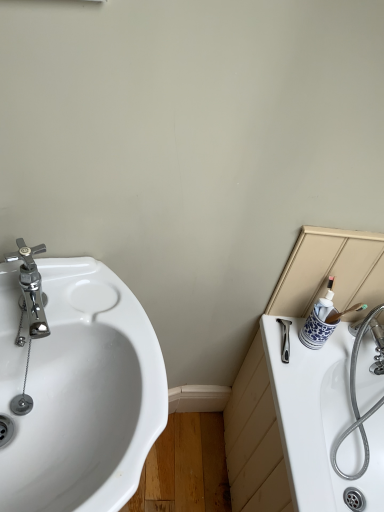
Locate an element on the screen. The height and width of the screenshot is (512, 384). free point behind chrome/metallic faucet at left is located at coordinates (67, 280).